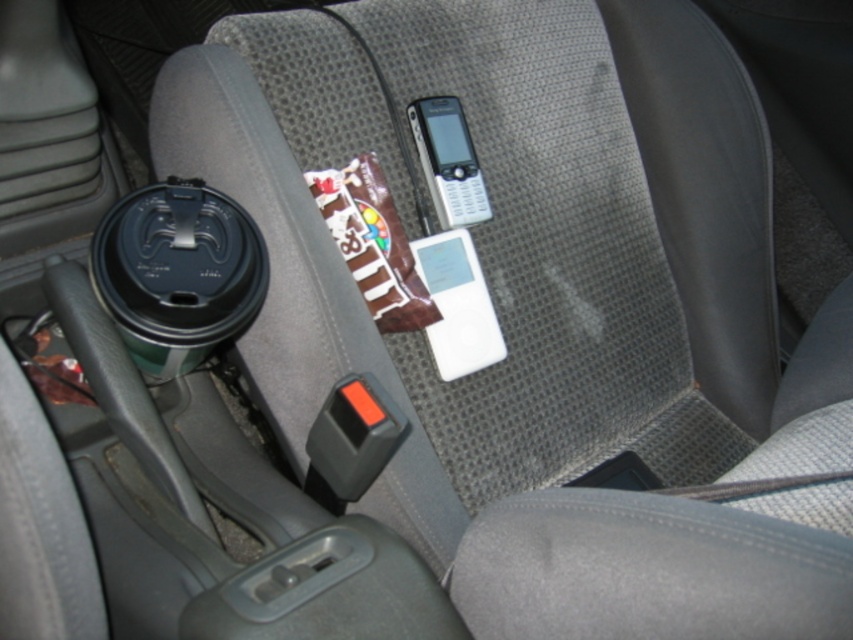
You are a passenger in a car and need to place a new phone case that is 5 inches tall. The case must fit over the silver metallic phone at center without covering the white matte ipod at center. Is this possible?

The white matte ipod at center is taller than the silver metallic phone at center. Since the case is 5 inches tall and the silver metallic phone is shorter, the case can fit over it without affecting the white matte ipod at center.

You are a passenger in a car and need to check your phone. You see the white matte ipod at center and the silver metallic phone at center. Which one has a wider screen?

The white matte ipod at center has a wider screen than the silver metallic phone at center according to the description.

You are sitting in the driver seat of the car and want to reach for either the white matte ipod at center or the silver metallic phone at center without moving your seat. Which device can you reach more easily?

The white matte ipod at center is closer to the viewer than the silver metallic phone at center, so it can be reached more easily without moving the seat.